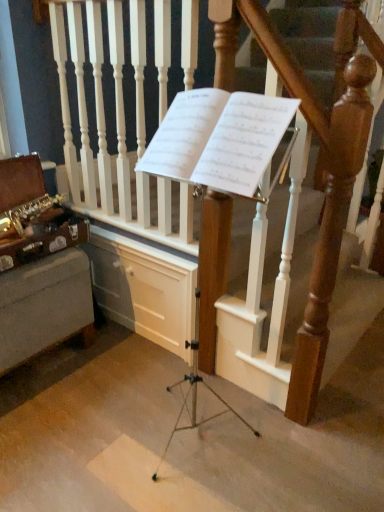
Question: Considering the relative sizes of white paper at center and gold brass saxophone at left in the image provided, is white paper at center shorter than gold brass saxophone at left?

Choices:
 (A) no
 (B) yes

Answer: (B)

Question: Is white paper at center bigger than gold brass saxophone at left?

Choices:
 (A) no
 (B) yes

Answer: (A)

Question: Does white paper at center have a greater width compared to gold brass saxophone at left?

Choices:
 (A) yes
 (B) no

Answer: (B)

Question: From the image's perspective, is white paper at center under gold brass saxophone at left?

Choices:
 (A) yes
 (B) no

Answer: (B)

Question: Considering the relative sizes of white paper at center and gold brass saxophone at left in the image provided, is white paper at center thinner than gold brass saxophone at left?

Choices:
 (A) yes
 (B) no

Answer: (A)

Question: Is point (158, 46) positioned closer to the camera than point (36, 246)?

Choices:
 (A) closer
 (B) farther

Answer: (A)

Question: Would you say wooden at center is inside or outside gold brass saxophone at left?

Choices:
 (A) inside
 (B) outside

Answer: (B)

Question: Considering the positions of wooden at center and gold brass saxophone at left in the image, is wooden at center taller or shorter than gold brass saxophone at left?

Choices:
 (A) tall
 (B) short

Answer: (A)

Question: From a real-world perspective, is wooden at center positioned above or below gold brass saxophone at left?

Choices:
 (A) above
 (B) below

Answer: (A)

Question: Is point coord(44,189) positioned closer to the camera than point coord(301,73)?

Choices:
 (A) closer
 (B) farther

Answer: (B)

Question: In the image, is gold brass saxophone at left on the left side or the right side of wooden at center?

Choices:
 (A) right
 (B) left

Answer: (B)

Question: Is gold brass saxophone at left spatially inside wooden at center, or outside of it?

Choices:
 (A) inside
 (B) outside

Answer: (B)

Question: In terms of size, does gold brass saxophone at left appear bigger or smaller than wooden at center?

Choices:
 (A) small
 (B) big

Answer: (A)

Question: Is white paper at center inside the boundaries of wooden at center, or outside?

Choices:
 (A) outside
 (B) inside

Answer: (A)

Question: Is white paper at center wider or thinner than wooden at center?

Choices:
 (A) wide
 (B) thin

Answer: (A)